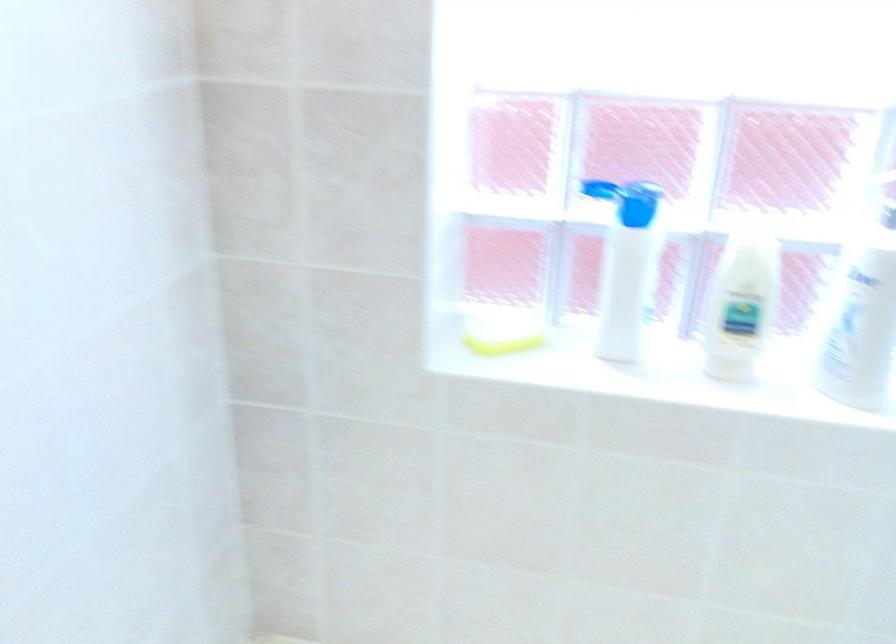
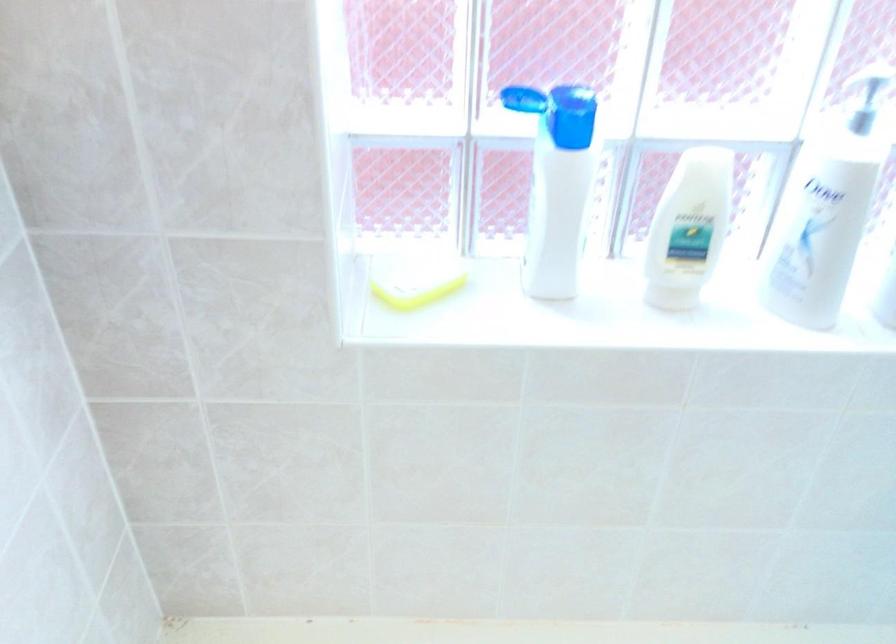
Question: The images are taken continuously from a first-person perspective. In which direction is your viewpoint rotating?

Choices:
 (A) Left
 (B) Right
 (C) Up
 (D) Down

Answer: (D)